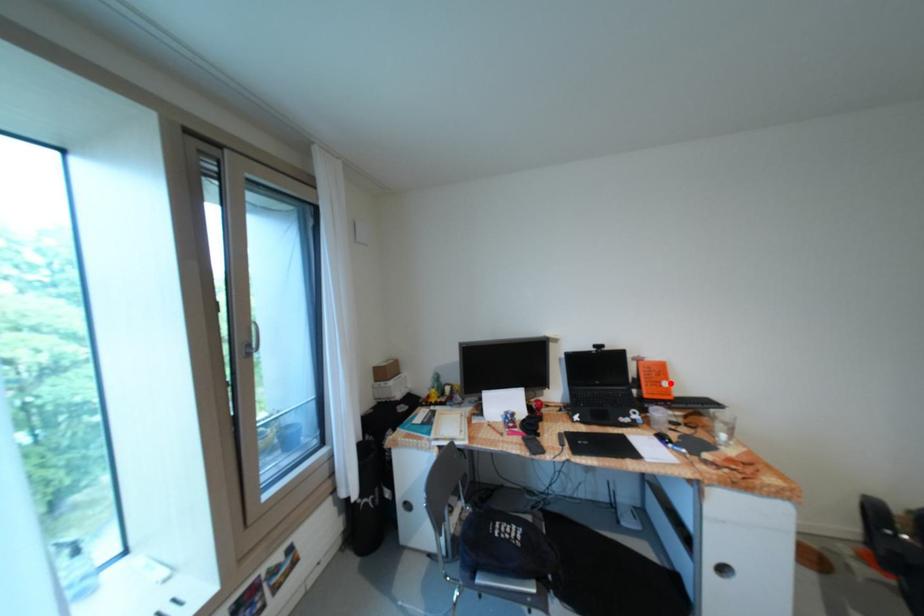
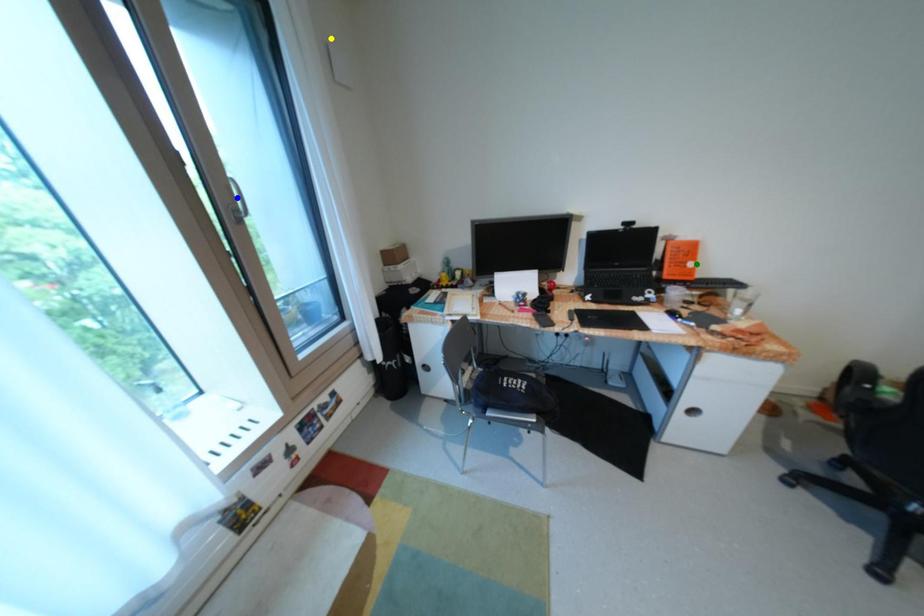
Question: I am providing you with two images of the same scene from different viewpoints. A red point is marked on the first image. You are given multiple points on the second image. Can you choose the point in image 2 that corresponds to the point in image 1?

Choices:
 (A) blue point
 (B) green point
 (C) yellow point

Answer: (B)